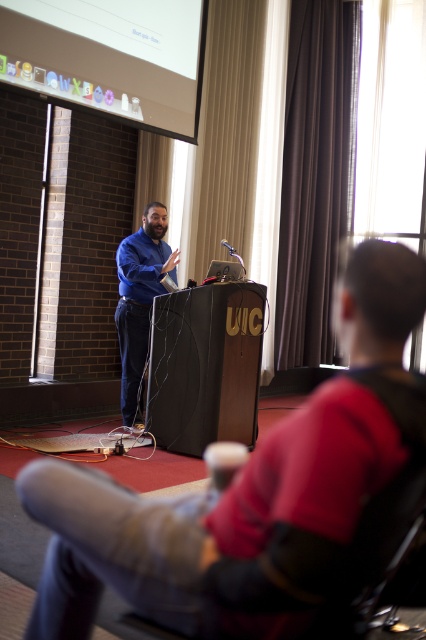
Who is positioned more to the right, blue shirt at center or white glossy projector screen at upper center?

Positioned to the right is blue shirt at center.

Between blue shirt at center and white glossy projector screen at upper center, which one is positioned higher?

white glossy projector screen at upper center is higher up.

Between point (313, 449) and point (111, 67), which one is positioned in front?

Point (313, 449) is in front.

Where is `blue shirt at center`? This screenshot has width=426, height=640. blue shirt at center is located at coordinates point(245,493).

Does white glossy projector screen at upper center appear on the right side of black matte podium at center?

In fact, white glossy projector screen at upper center is to the left of black matte podium at center.

Can you confirm if white glossy projector screen at upper center is wider than black matte podium at center?

Yes, white glossy projector screen at upper center is wider than black matte podium at center.

Between point (42, 10) and point (207, 412), which one is positioned behind?

Point (207, 412)

Locate an element on the screen. white glossy projector screen at upper center is located at coordinates (109, 56).

Who is lower down, black matte podium at center or blue smooth shirt at center?

black matte podium at center is below.

Who is more forward, (230, 330) or (143, 240)?

Point (230, 330) is in front.

Where is `black matte podium at center`? The image size is (426, 640). black matte podium at center is located at coordinates (204, 365).